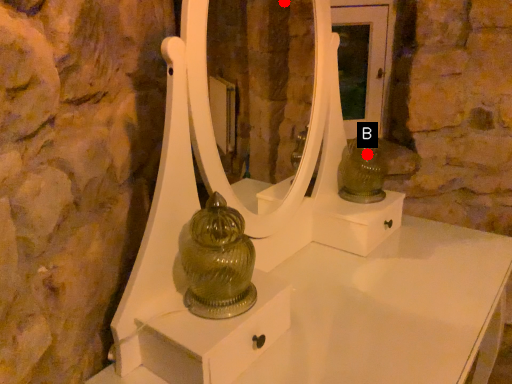
Question: Two points are circled on the image, labeled by A and B beside each circle. Which point is closer to the camera?

Choices:
 (A) A is closer
 (B) B is closer

Answer: (B)